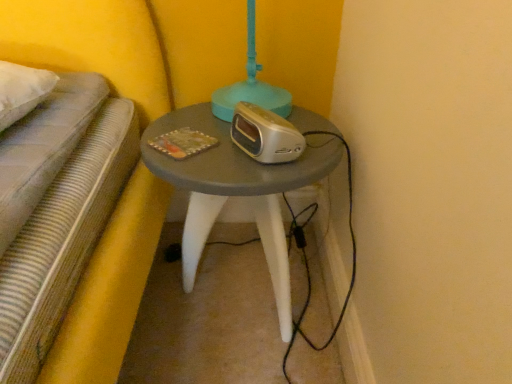
The image size is (512, 384). In order to click on blank space situated above matte gray table at center (from a real-world perspective) in this screenshot , I will do `click(233, 134)`.